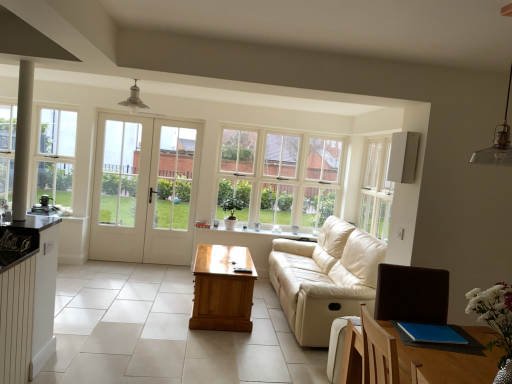
The image size is (512, 384). What are the coordinates of `vacant space to the left of light brown wooden table at center` in the screenshot? It's located at (156, 300).